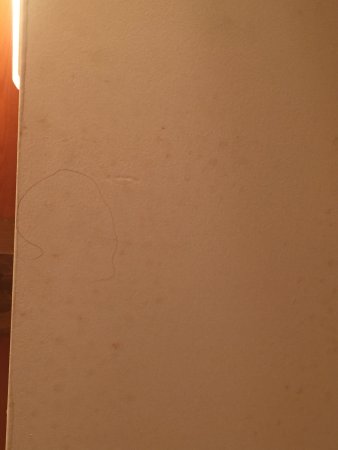
The image size is (338, 450). Find the location of `light`. light is located at coordinates (16, 71).